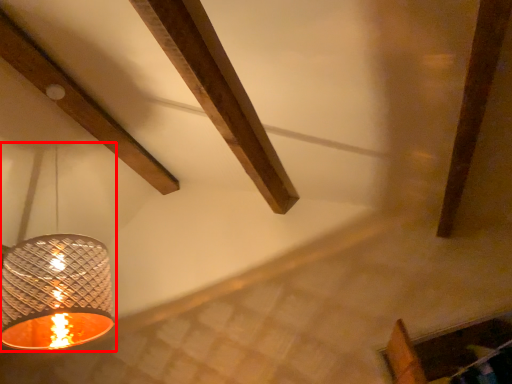
Question: Considering the relative positions of lamp (annotated by the red box) and plank in the image provided, where is lamp (annotated by the red box) located with respect to the staircase?

Choices:
 (A) left
 (B) right

Answer: (B)